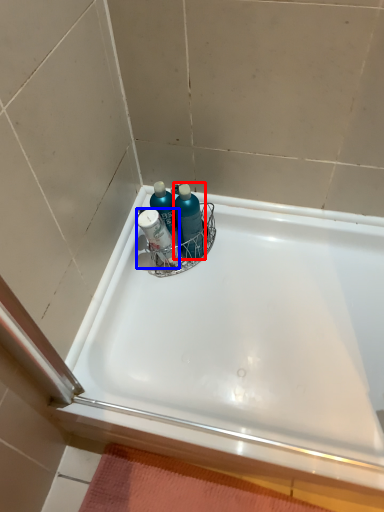
Question: Which point is closer to the camera, cleaning product (highlighted by a red box) or mouthwash (highlighted by a blue box)?

Choices:
 (A) cleaning product
 (B) mouthwash

Answer: (B)